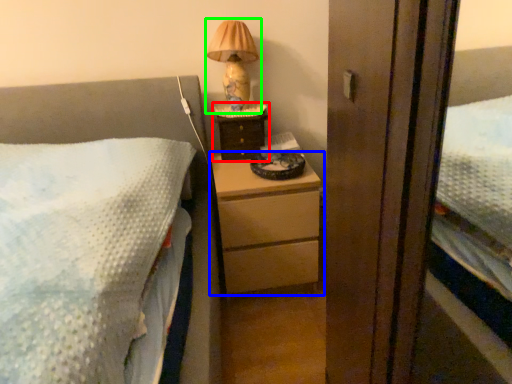
Question: Estimate the real-world distances between objects in this image. Which object is farther from nightstand (highlighted by a red box), chest of drawers (highlighted by a blue box) or table lamp (highlighted by a green box)?

Choices:
 (A) chest of drawers
 (B) table lamp

Answer: (A)